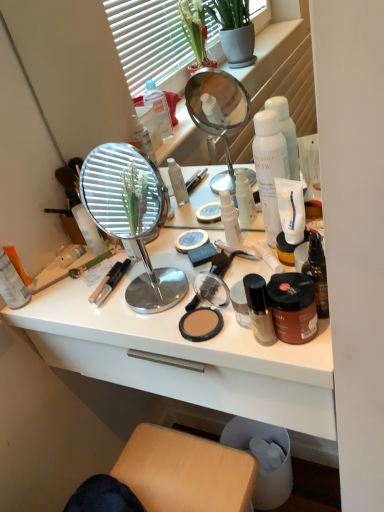
At what (x,y) coordinates should I click in order to perform the action: click on vacant space behind matte black compact at center. Please return your answer as a coordinate pair (x, y). The height and width of the screenshot is (512, 384). Looking at the image, I should click on click(x=174, y=268).